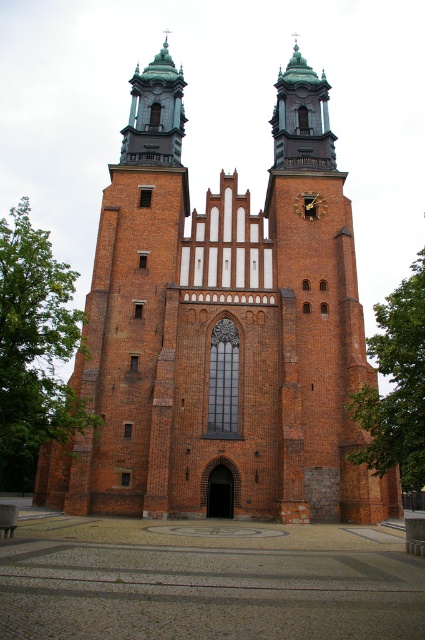
Question: Does brick church at center have a lesser width compared to gold metallic clock at center?

Choices:
 (A) yes
 (B) no

Answer: (B)

Question: Can you confirm if brick church at center is bigger than gold metallic clock at center?

Choices:
 (A) yes
 (B) no

Answer: (A)

Question: Can you confirm if brick church at center is positioned above gold metallic clock at center?

Choices:
 (A) yes
 (B) no

Answer: (B)

Question: Which point appears closest to the camera in this image?

Choices:
 (A) (300, 211)
 (B) (249, 224)

Answer: (A)

Question: Which object appears closest to the camera in this image?

Choices:
 (A) gold metallic clock at center
 (B) brick church at center

Answer: (B)